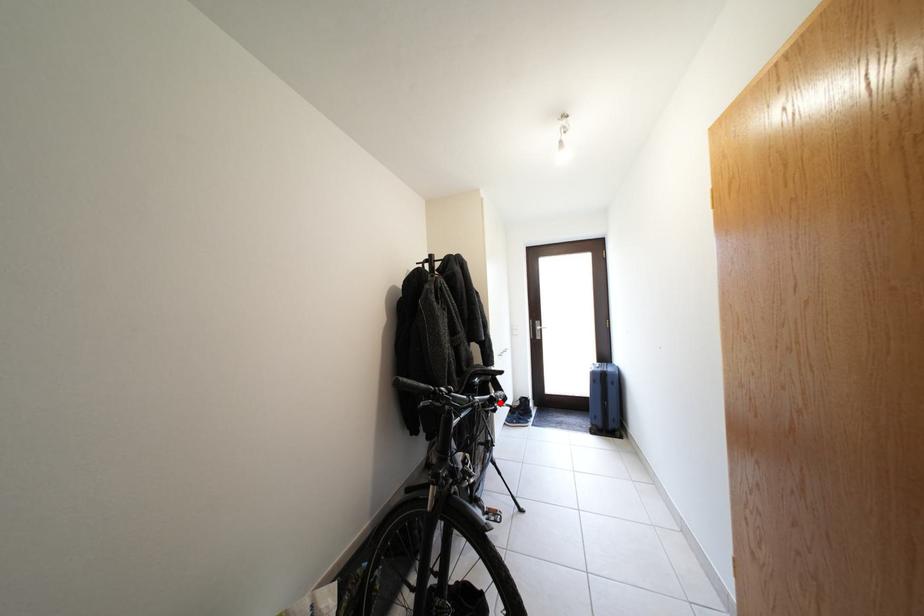
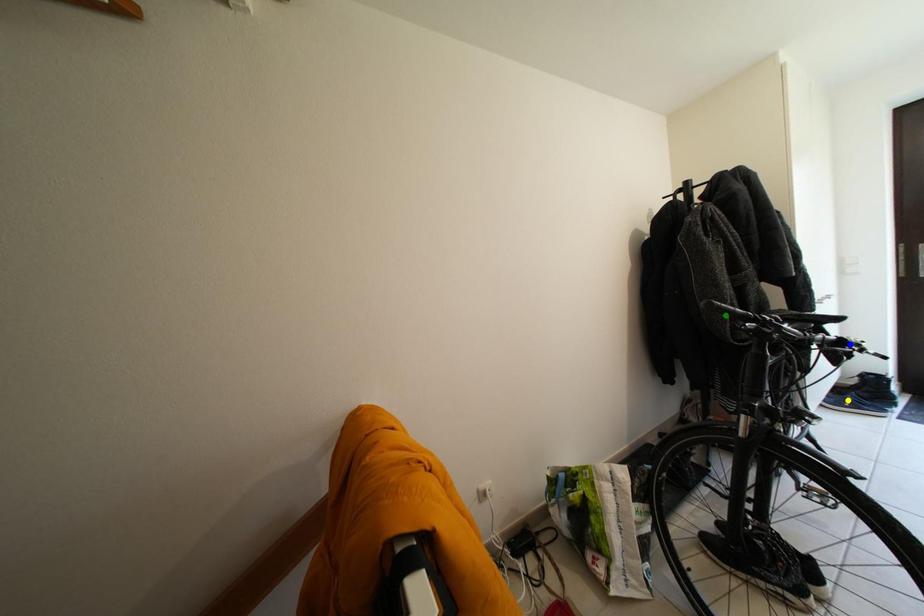
Question: I am providing you with two images of the same scene from different viewpoints. A red point is marked on the first image. You are given multiple points on the second image. Which point in image 2 represents the same 3d spot as the red point in image 1?

Choices:
 (A) green point
 (B) blue point
 (C) yellow point

Answer: (B)